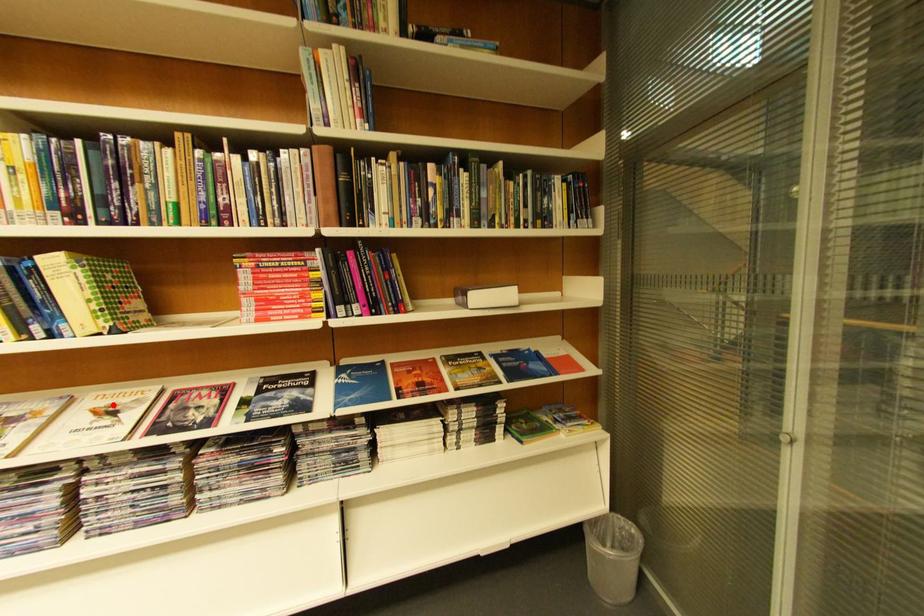
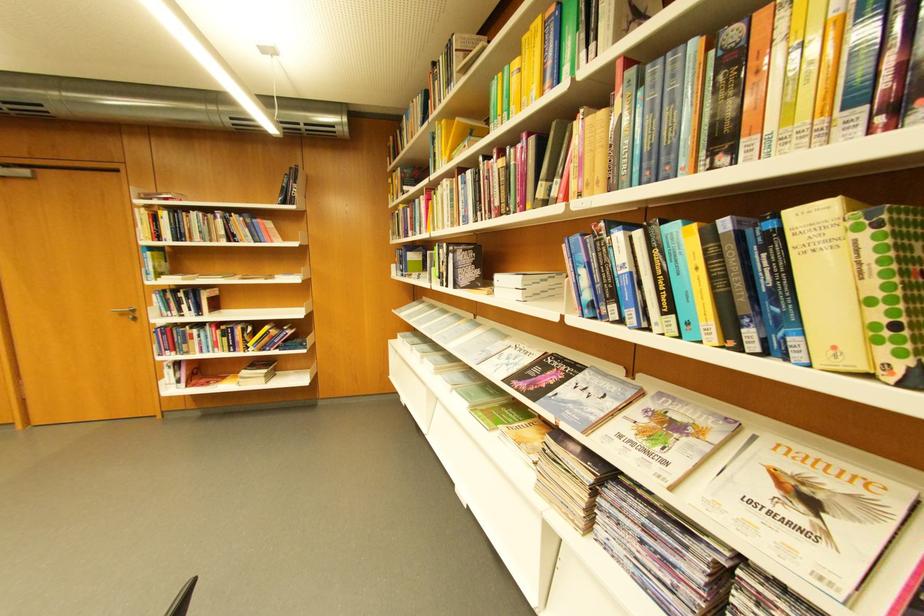
The point at the highlighted location is marked in the first image. Where is the corresponding point in the second image?

(800, 469)